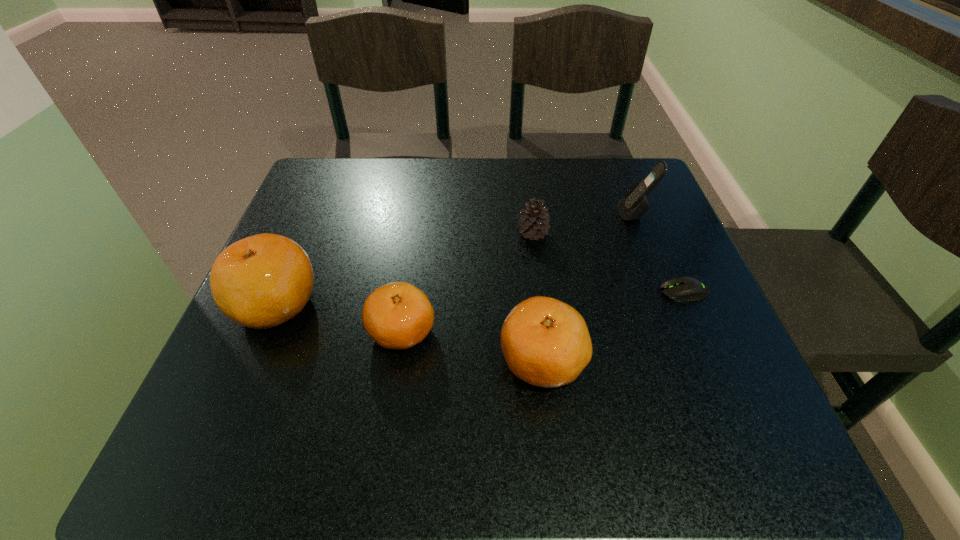
Identify the location of object that stands as the fifth closest to the cellular telephone. This screenshot has height=540, width=960. (262, 281).

This screenshot has width=960, height=540. Identify the location of object that stands as the fourth closest to the leftmost object. (634, 204).

This screenshot has height=540, width=960. Identify the location of clementine that can be found as the third closest to the cellular telephone. (262, 281).

Where is `clementine that is the third closest to the shortest object`? The width and height of the screenshot is (960, 540). clementine that is the third closest to the shortest object is located at coordinates (262, 281).

Locate an element on the screen. This screenshot has width=960, height=540. vacant region that satisfies the following two spatial constraints: 1. on the front side of the rightmost clementine; 2. on the left side of the second clementine from right to left is located at coordinates (397, 361).

Image resolution: width=960 pixels, height=540 pixels. Identify the location of blank area in the image that satisfies the following two spatial constraints: 1. on the wheel side of the shortest object; 2. on the front side of the shortest clementine. (700, 332).